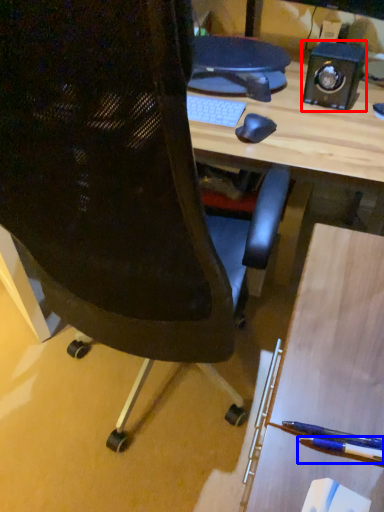
Question: Among these objects, which one is farthest to the camera, speaker (highlighted by a red box) or pencil (highlighted by a blue box)?

Choices:
 (A) speaker
 (B) pencil

Answer: (A)